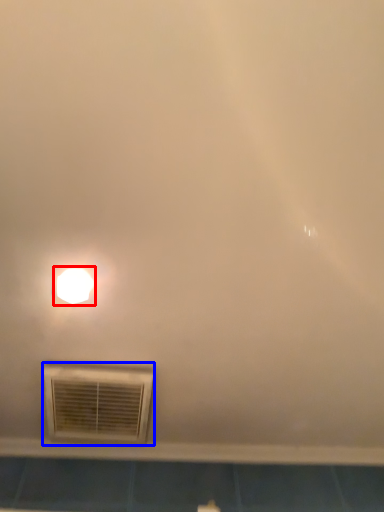
Question: Which object is closer to the camera taking this photo, lamp (highlighted by a red box) or air conditioning (highlighted by a blue box)?

Choices:
 (A) lamp
 (B) air conditioning

Answer: (A)